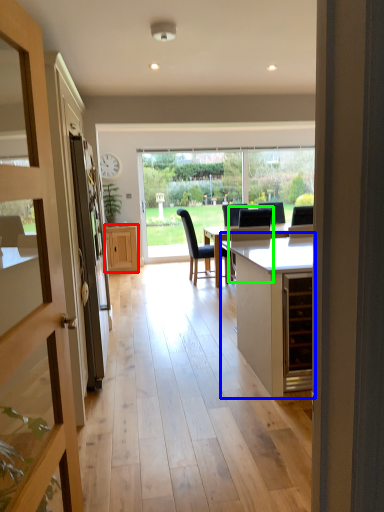
Question: Which object is the closest to the cabinetry (highlighted by a red box)? Choose among these: cabinetry (highlighted by a blue box) or swivel chair (highlighted by a green box).

Choices:
 (A) cabinetry
 (B) swivel chair

Answer: (B)